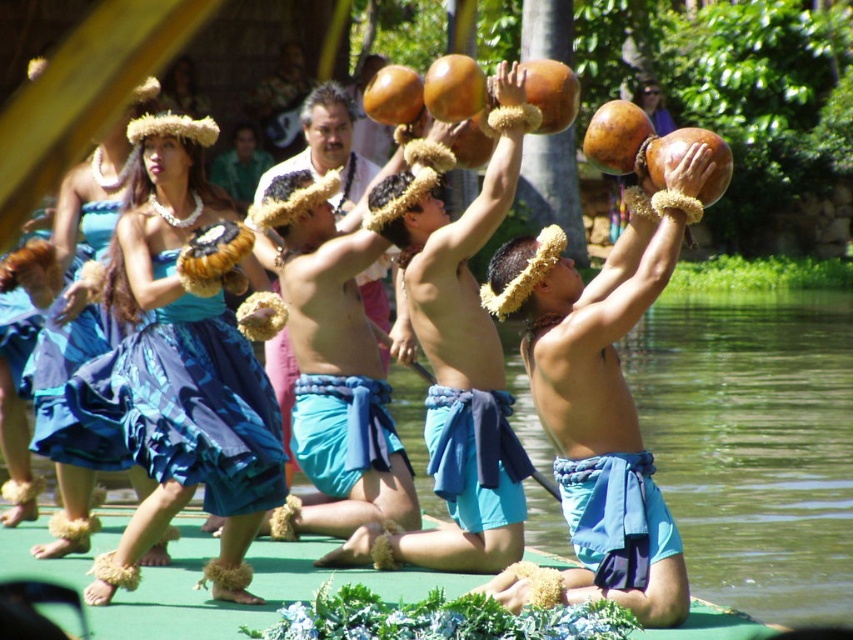
Is matte coconut shell at upper center above smooth brown coconut at center?

No.

Does matte coconut shell at upper center have a lesser width compared to smooth brown coconut at center?

Correct, matte coconut shell at upper center's width is less than smooth brown coconut at center's.

Who is more distant from viewer, (647, 561) or (432, 326)?

Positioned behind is point (432, 326).

This screenshot has width=853, height=640. Identify the location of matte coconut shell at upper center. (602, 394).

Between point (497, 131) and point (125, 362), which one is positioned in front?

Positioned in front is point (125, 362).

What do you see at coordinates (456, 360) in the screenshot? The width and height of the screenshot is (853, 640). I see `smooth brown coconut at center` at bounding box center [456, 360].

At what (x,y) coordinates should I click in order to perform the action: click on smooth brown coconut at center. Please return your answer as a coordinate pair (x, y). This screenshot has height=640, width=853. Looking at the image, I should click on (456, 360).

Identify the location of smooth brown coconut at center. (456, 360).

Between point (483, 305) and point (161, 397), which one is positioned behind?

The point (483, 305) is more distant.

Is matte coconut shell at upper center shorter than blue satin dress at center?

In fact, matte coconut shell at upper center may be taller than blue satin dress at center.

Locate an element on the screen. matte coconut shell at upper center is located at coordinates (602, 394).